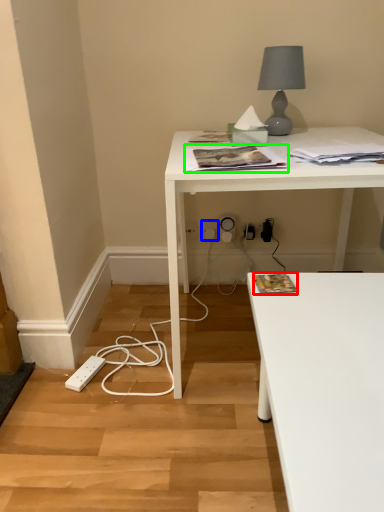
Question: Which object is positioned farthest from magazine (highlighted by a red box)? Select from electric outlet (highlighted by a blue box) and magazine (highlighted by a green box).

Choices:
 (A) electric outlet
 (B) magazine

Answer: (A)